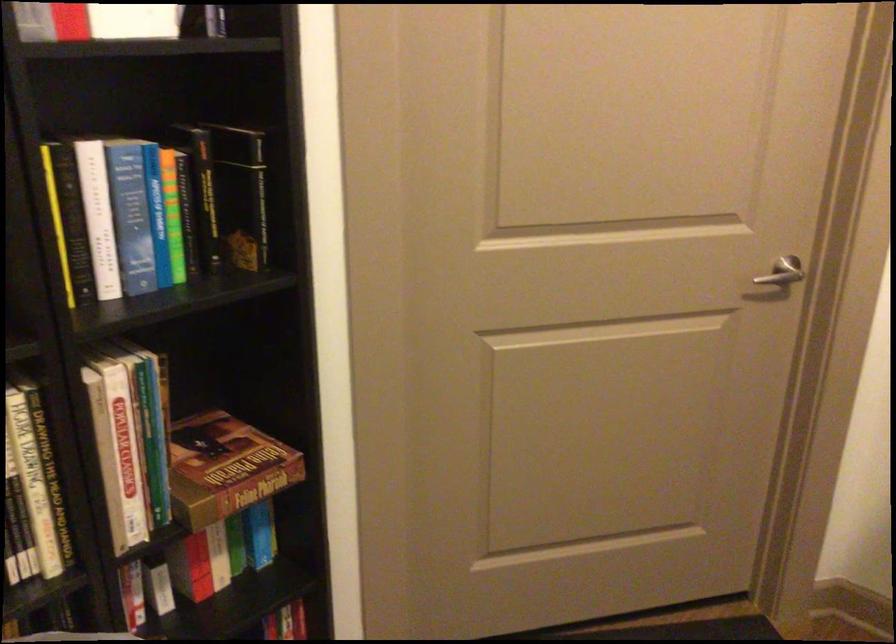
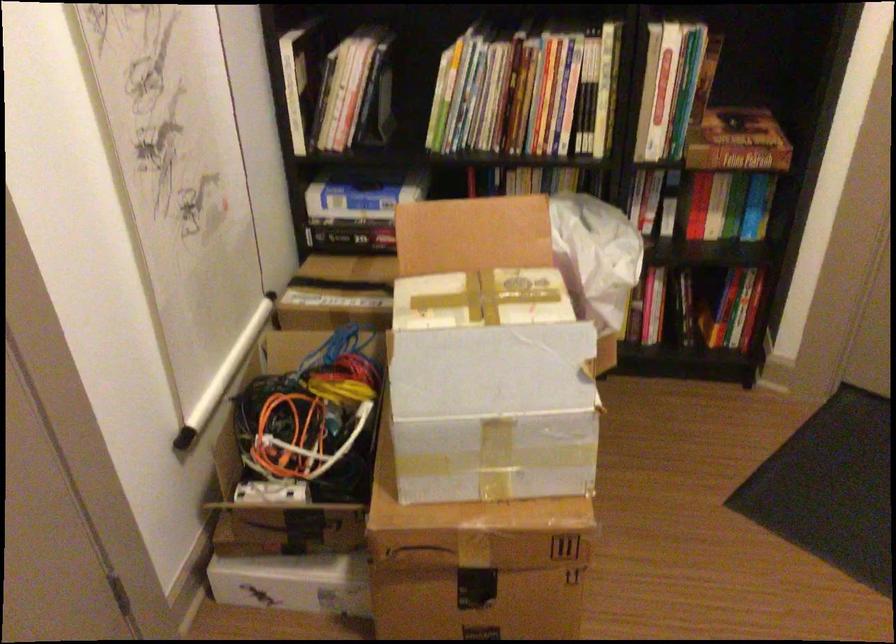
The point at (99,570) is marked in the first image. Where is the corresponding point in the second image?

(618, 161)